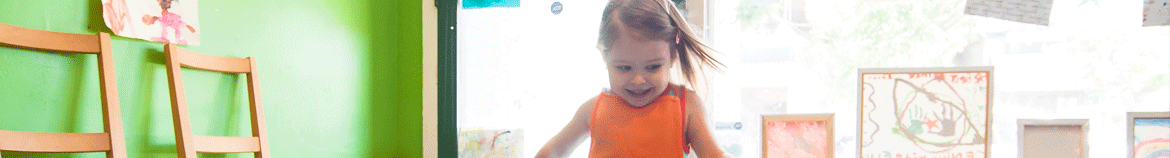
The image size is (1170, 158). Identify the location of child's painting. (167, 14).